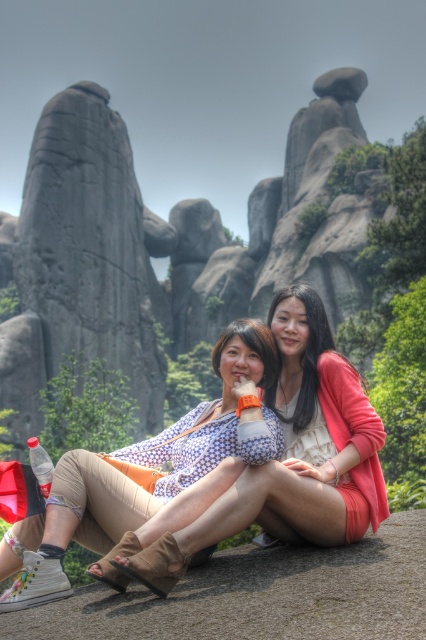
Does smooth gray rock at left appear on the right side of brown leather shoe at lower center?

No, smooth gray rock at left is not to the right of brown leather shoe at lower center.

Based on the photo, does smooth gray rock at left have a greater width compared to brown leather shoe at lower center?

→ Yes, smooth gray rock at left is wider than brown leather shoe at lower center.

Who is more distant from viewer, (71, 97) or (189, 588)?

The point (71, 97) is behind.

Find the location of a particular element. smooth gray rock at left is located at coordinates (80, 262).

Can you confirm if smooth gray rock at left is positioned to the right of matte floral blouse at center?

In fact, smooth gray rock at left is to the left of matte floral blouse at center.

Which of these two, smooth gray rock at left or matte floral blouse at center, stands shorter?

With less height is matte floral blouse at center.

Does point (92, 225) come in front of point (146, 444)?

No.

Identify the location of smooth gray rock at left. Image resolution: width=426 pixels, height=640 pixels. (80, 262).

Which is more to the left, matte orange shorts at center or brown leather shoe at lower center?

matte orange shorts at center

Between point (143, 554) and point (180, 620), which one is positioned behind?

The point (143, 554) is behind.

The height and width of the screenshot is (640, 426). In order to click on matte orange shorts at center in this screenshot , I will do `click(279, 461)`.